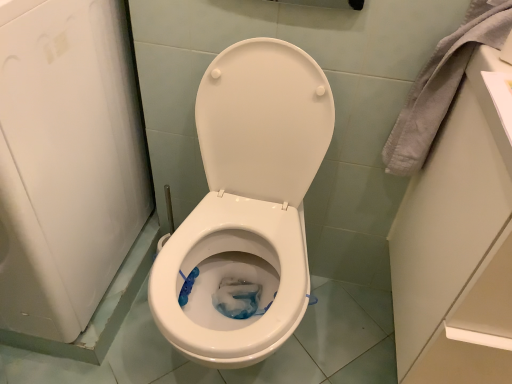
Question: From a real-world perspective, is gray fabric towel at upper right physically above white glossy toilet at center?

Choices:
 (A) yes
 (B) no

Answer: (A)

Question: From the image's perspective, is gray fabric towel at upper right under white glossy toilet at center?

Choices:
 (A) yes
 (B) no

Answer: (B)

Question: Is gray fabric towel at upper right bigger than white glossy toilet at center?

Choices:
 (A) no
 (B) yes

Answer: (A)

Question: Is gray fabric towel at upper right directly adjacent to white glossy toilet at center?

Choices:
 (A) yes
 (B) no

Answer: (B)

Question: Considering the relative sizes of gray fabric towel at upper right and white glossy toilet at center in the image provided, is gray fabric towel at upper right thinner than white glossy toilet at center?

Choices:
 (A) no
 (B) yes

Answer: (B)

Question: Considering the relative sizes of gray fabric towel at upper right and white glossy toilet at center in the image provided, is gray fabric towel at upper right taller than white glossy toilet at center?

Choices:
 (A) no
 (B) yes

Answer: (A)

Question: Is white glossy toilet at center not within gray fabric towel at upper right?

Choices:
 (A) yes
 (B) no

Answer: (A)

Question: From a real-world perspective, is white glossy toilet at center on top of gray fabric towel at upper right?

Choices:
 (A) yes
 (B) no

Answer: (B)

Question: From a real-world perspective, is white glossy toilet at center beneath gray fabric towel at upper right?

Choices:
 (A) yes
 (B) no

Answer: (A)

Question: Can you confirm if white glossy toilet at center is shorter than gray fabric towel at upper right?

Choices:
 (A) no
 (B) yes

Answer: (A)

Question: Is white glossy toilet at center not near gray fabric towel at upper right?

Choices:
 (A) yes
 (B) no

Answer: (B)

Question: Could you tell me if white glossy toilet at center is turned towards gray fabric towel at upper right?

Choices:
 (A) yes
 (B) no

Answer: (B)

Question: Do you think gray fabric towel at upper right is within white glossy toilet at center, or outside of it?

Choices:
 (A) inside
 (B) outside

Answer: (B)